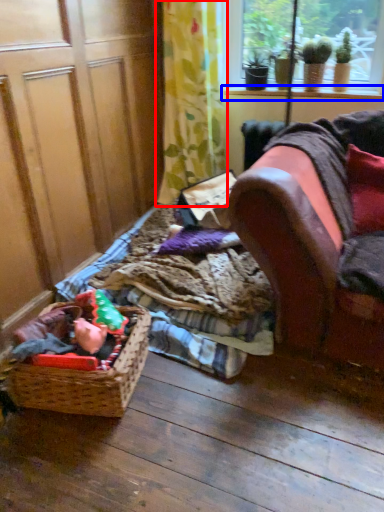
Question: Which object is closer to the camera taking this photo, curtain (highlighted by a red box) or window sill (highlighted by a blue box)?

Choices:
 (A) curtain
 (B) window sill

Answer: (A)